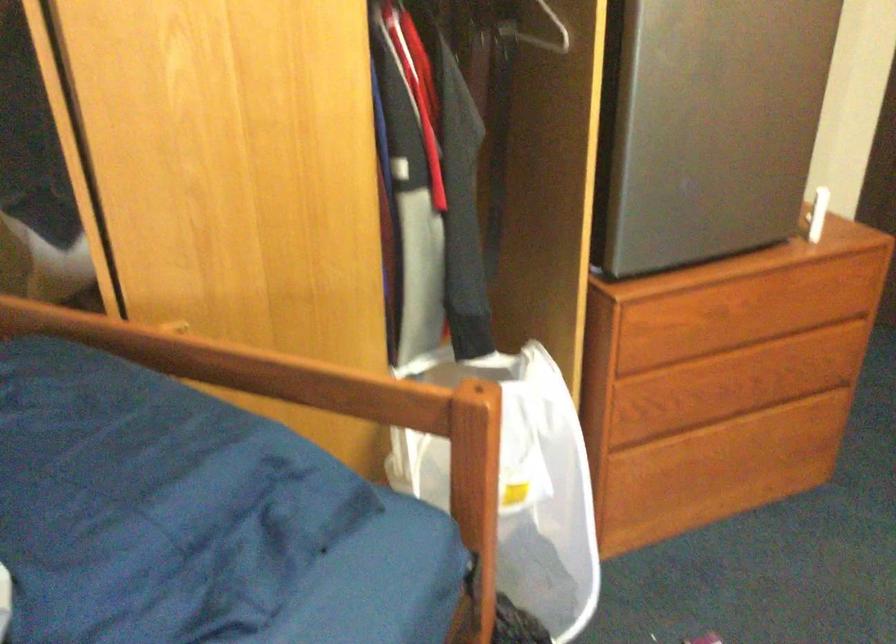
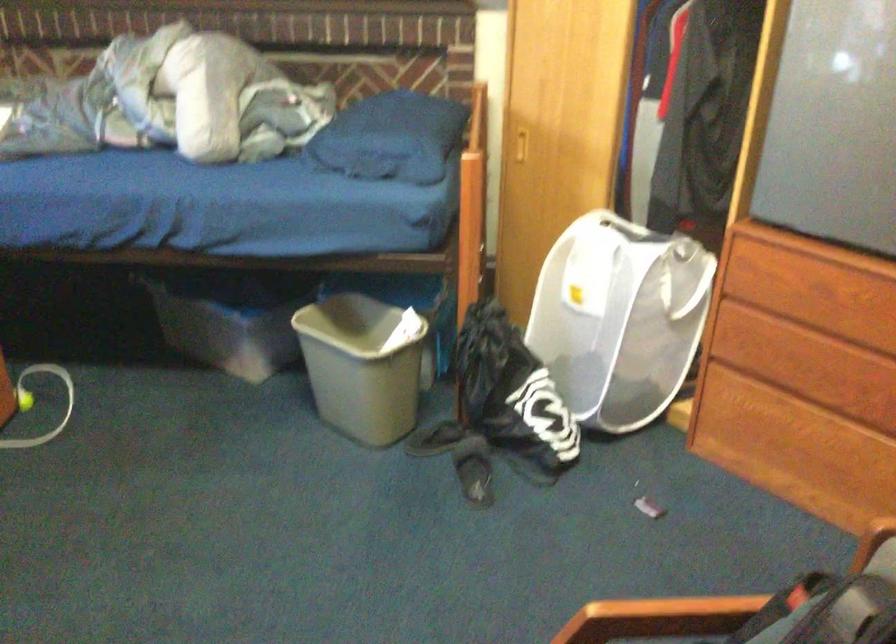
Find the pixel in the second image that matches point (718, 420) in the first image.

(819, 413)